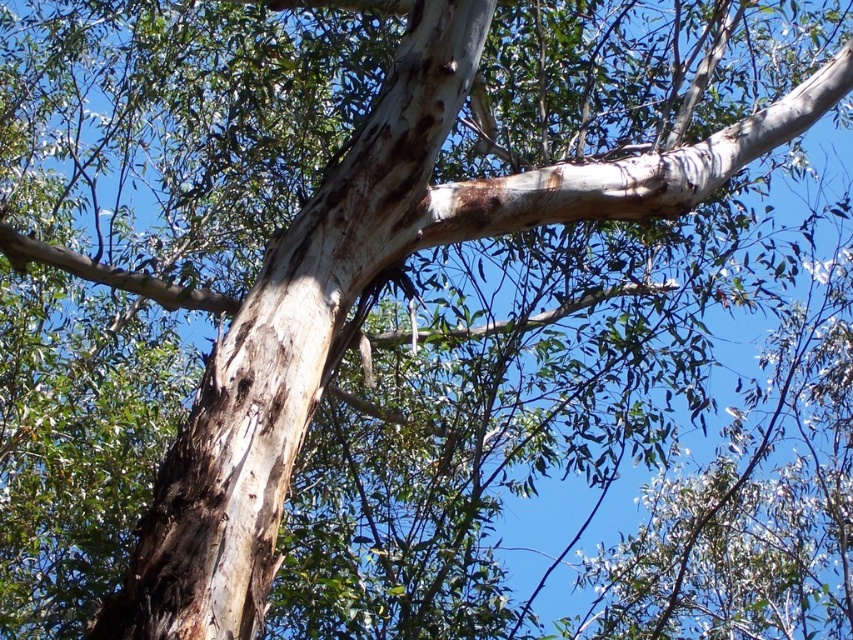
Question: Can you confirm if white rough bark branch at upper center is smaller than smooth bark branch at upper center?

Choices:
 (A) no
 (B) yes

Answer: (A)

Question: Which object is the closest to the smooth bark branch at upper center?

Choices:
 (A) smooth white bark at center
 (B) white rough bark branch at upper center

Answer: (B)

Question: Is white rough bark branch at upper center to the right of smooth bark branch at upper center from the viewer's perspective?

Choices:
 (A) yes
 (B) no

Answer: (A)

Question: Is smooth white bark at center in front of smooth bark branch at upper center?

Choices:
 (A) no
 (B) yes

Answer: (B)

Question: Which point is farther to the camera?

Choices:
 (A) [213, 301]
 (B) [137, 611]

Answer: (A)

Question: Based on their relative distances, which object is farther from the smooth bark branch at upper center?

Choices:
 (A) white rough bark branch at upper center
 (B) smooth white bark at center

Answer: (B)